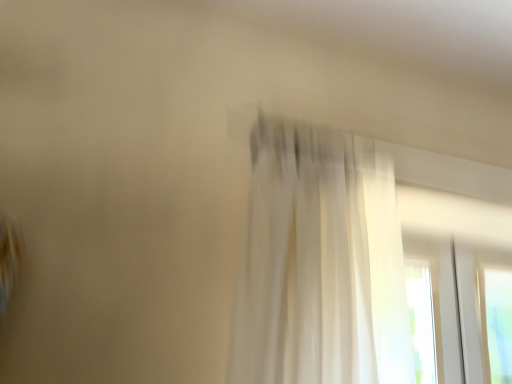
Describe the element at coordinates (320, 263) in the screenshot. The image size is (512, 384). I see `sheer white curtain at upper center` at that location.

At what (x,y) coordinates should I click in order to perform the action: click on sheer white curtain at upper center. Please return your answer as a coordinate pair (x, y). Image resolution: width=512 pixels, height=384 pixels. Looking at the image, I should click on (320, 263).

You are a GUI agent. You are given a task and a screenshot of the screen. Output one action in this format:
    pyautogui.click(x=<x>, y=<y>)
    Task: Click on the sheer white curtain at upper center
    
    Given the screenshot: What is the action you would take?
    pyautogui.click(x=320, y=263)